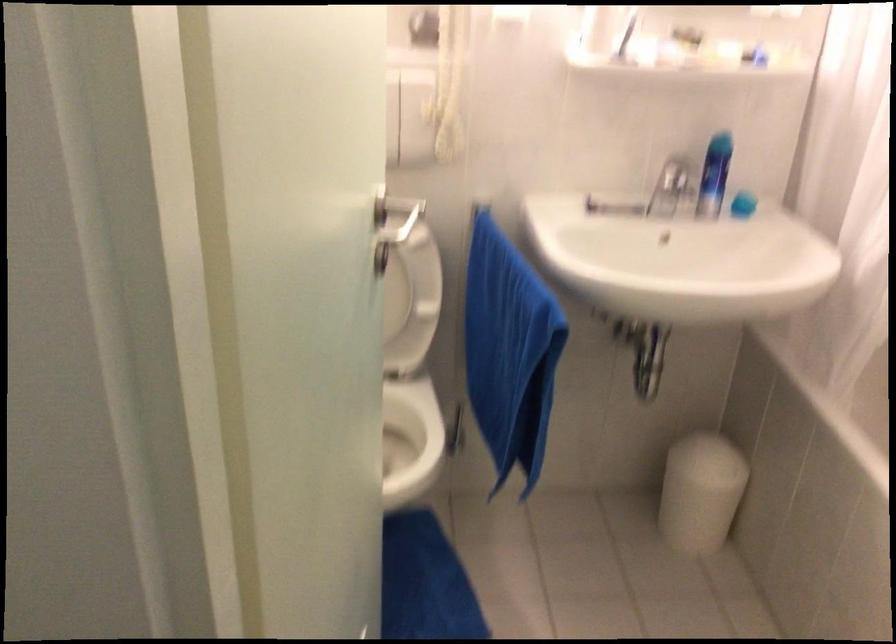
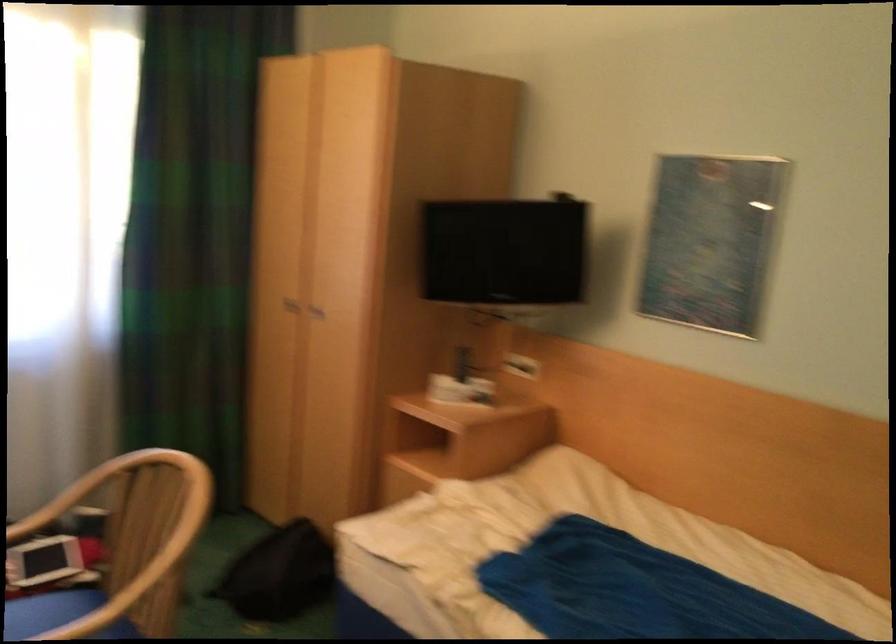
Question: The camera is either moving clockwise (left) or counter-clockwise (right) around the object. The first image is from the beginning of the video and the second image is from the end. Is the camera moving left or right when shooting the video?

Choices:
 (A) Left
 (B) Right

Answer: (B)